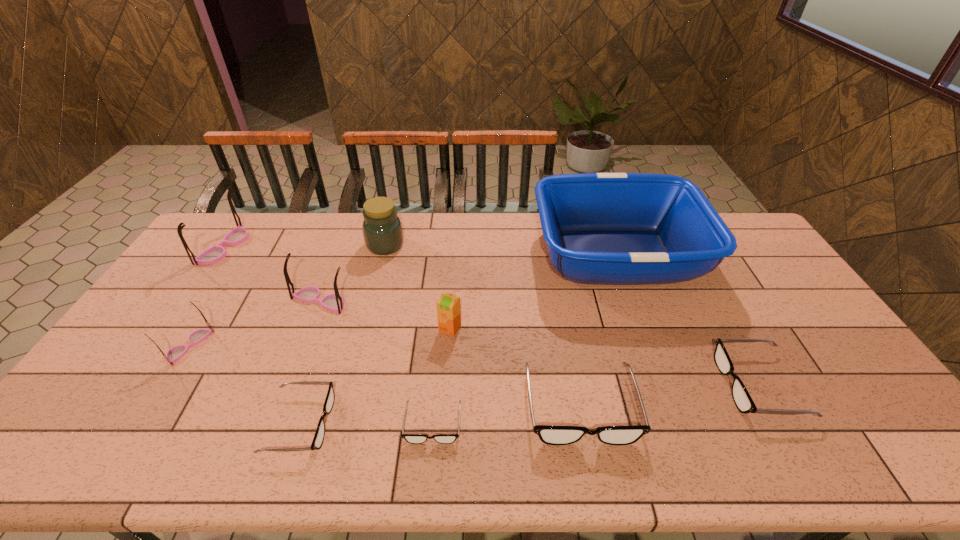
Identify which black spectacles is the second nearest to the rightmost spectacles. Please provide its 2D coordinates. Your answer should be formatted as a tuple, i.e. [(x, y)], where the tuple contains the x and y coordinates of a point satisfying the conditions above.

[(410, 438)]

Locate which black spectacles is the second closest to the eighth tallest object. Please provide its 2D coordinates. Your answer should be formatted as a tuple, i.e. [(x, y)], where the tuple contains the x and y coordinates of a point satisfying the conditions above.

[(410, 438)]

The width and height of the screenshot is (960, 540). Find the location of `vacant space that satisfies the following two spatial constraints: 1. on the front-facing side of the rightmost black spectacles; 2. on the front-facing side of the second black spectacles from left to right`. vacant space that satisfies the following two spatial constraints: 1. on the front-facing side of the rightmost black spectacles; 2. on the front-facing side of the second black spectacles from left to right is located at coordinates (780, 424).